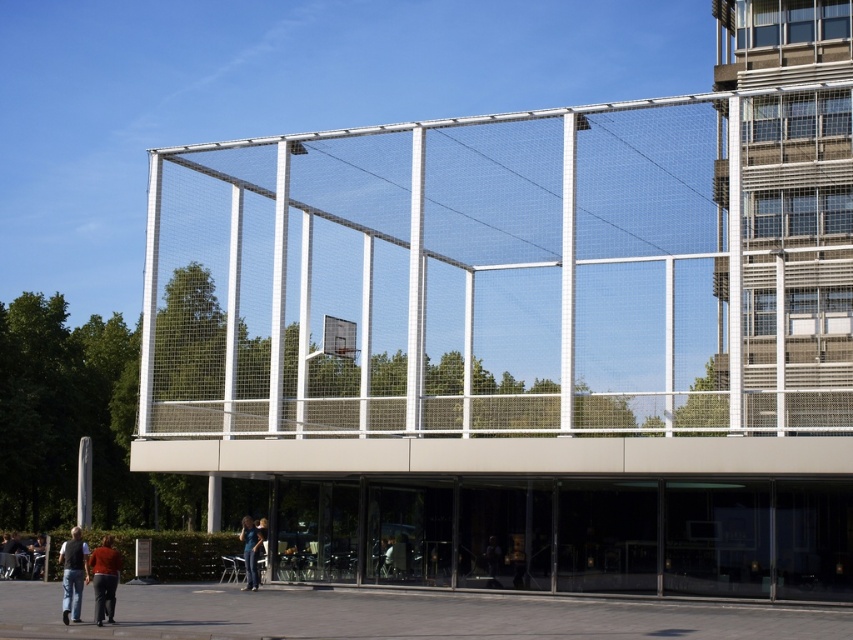
Is white mesh fence at center shorter than dark brown leather jacket at lower center?

Incorrect, white mesh fence at center's height does not fall short of dark brown leather jacket at lower center's.

Does white mesh fence at center have a greater width compared to dark brown leather jacket at lower center?

Yes.

Is point (149, 161) in front of point (492, 541)?

That is False.

Identify the location of white mesh fence at center. The height and width of the screenshot is (640, 853). (497, 276).

Is denim jeans at lower left to the left of denim jacket at lower center from the viewer's perspective?

Yes, denim jeans at lower left is to the left of denim jacket at lower center.

Is denim jeans at lower left to the right of denim jacket at lower center from the viewer's perspective?

No, denim jeans at lower left is not to the right of denim jacket at lower center.

Which is behind, point (64, 541) or point (244, 536)?

Point (64, 541)

Image resolution: width=853 pixels, height=640 pixels. Find the location of `denim jeans at lower left`. denim jeans at lower left is located at coordinates (73, 573).

Which is more to the right, denim jeans at lower left or metallic silver basketball hoop at center?

metallic silver basketball hoop at center

Does denim jeans at lower left come in front of metallic silver basketball hoop at center?

Yes.

What do you see at coordinates (73, 573) in the screenshot?
I see `denim jeans at lower left` at bounding box center [73, 573].

Find the location of a particular element. This screenshot has height=640, width=853. denim jeans at lower left is located at coordinates (73, 573).